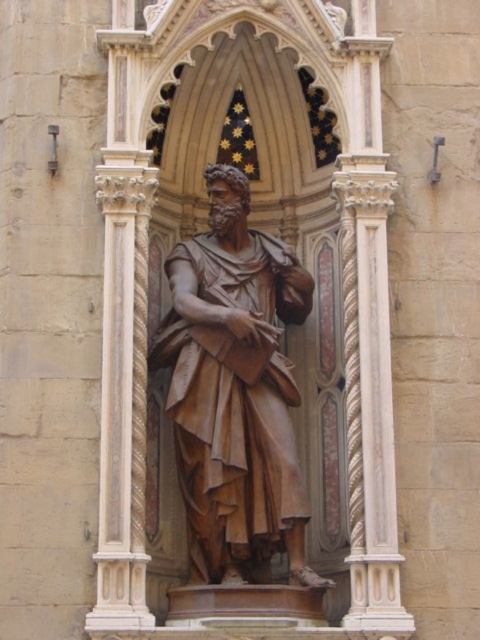
Who is more forward, [247,467] or [387,588]?

Positioned in front is point [387,588].

Is brown polished wood statue at center positioned at the back of white marble column at center?

Yes, brown polished wood statue at center is further from the viewer.

Is point (276, 273) positioned behind point (367, 122)?

That is False.

Find the location of a particular element. The height and width of the screenshot is (640, 480). brown polished wood statue at center is located at coordinates (235, 392).